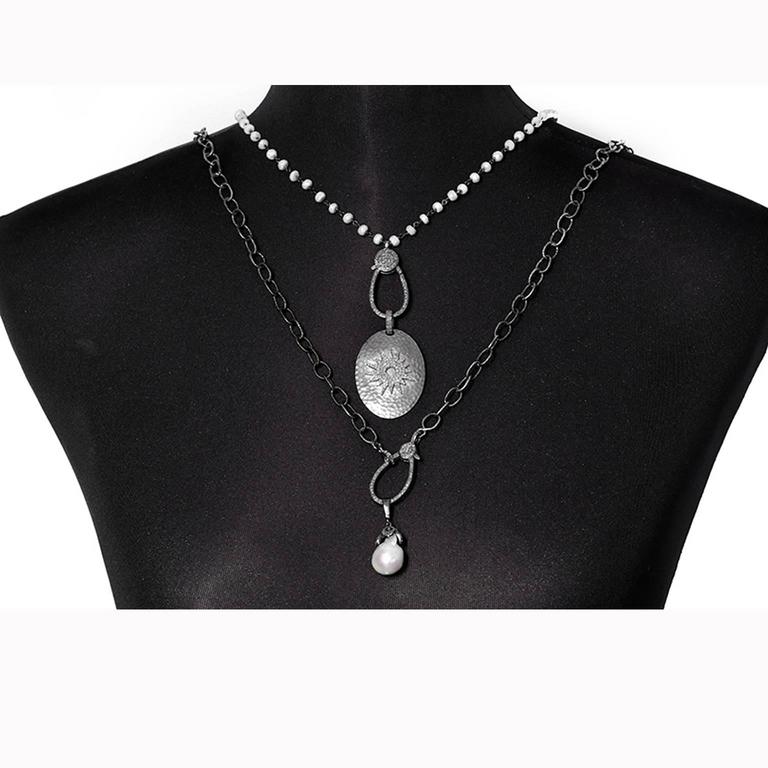
Where is `white round pendant`? This screenshot has height=768, width=768. white round pendant is located at coordinates (382, 561).